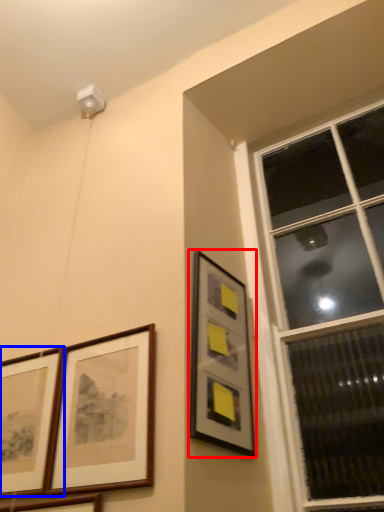
Question: Which object is closer to the camera taking this photo, picture frame (highlighted by a red box) or picture frame (highlighted by a blue box)?

Choices:
 (A) picture frame
 (B) picture frame

Answer: (A)